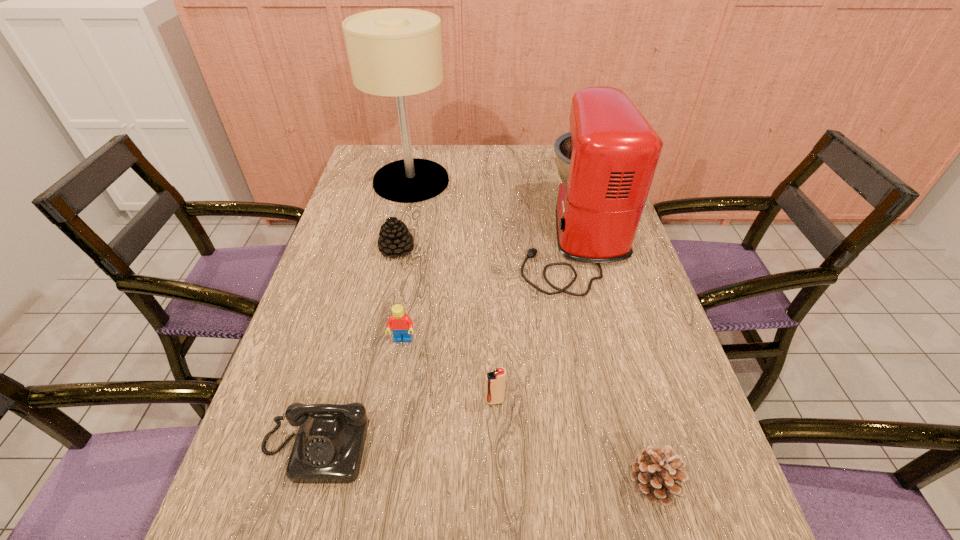
At what (x,y) coordinates should I click in order to perform the action: click on kitchen mixer that is positioned at the right edge. Please return your answer as a coordinate pair (x, y). Image resolution: width=960 pixels, height=540 pixels. Looking at the image, I should click on (607, 161).

Where is `pinecone that is at the right edge`? The image size is (960, 540). pinecone that is at the right edge is located at coordinates (654, 473).

The image size is (960, 540). I want to click on object that is at the far left corner, so click(x=397, y=52).

This screenshot has width=960, height=540. What are the coordinates of `vacant position at the far edge of the desktop` in the screenshot? It's located at (484, 160).

This screenshot has height=540, width=960. What are the coordinates of `vacant region at the left edge` in the screenshot? It's located at (326, 357).

I want to click on vacant space at the right edge of the desktop, so click(x=694, y=399).

Find the location of `free space between the Lego and the third nearest object`. free space between the Lego and the third nearest object is located at coordinates (448, 370).

You are a GUI agent. You are given a task and a screenshot of the screen. Output one action in this format:
    pyautogui.click(x=<x>, y=<y>)
    Task: Click on the free space between the Lego and the telephone
    
    Given the screenshot: What is the action you would take?
    pyautogui.click(x=359, y=394)

Locate an element on the screen. The height and width of the screenshot is (540, 960). unoccupied area between the sixth shortest object and the nearer pinecone is located at coordinates (613, 361).

You are a GUI agent. You are given a task and a screenshot of the screen. Output one action in this format:
    pyautogui.click(x=<x>, y=<y>)
    Task: Click on the blank region between the table lamp and the third object from right to left
    
    Given the screenshot: What is the action you would take?
    pyautogui.click(x=453, y=291)